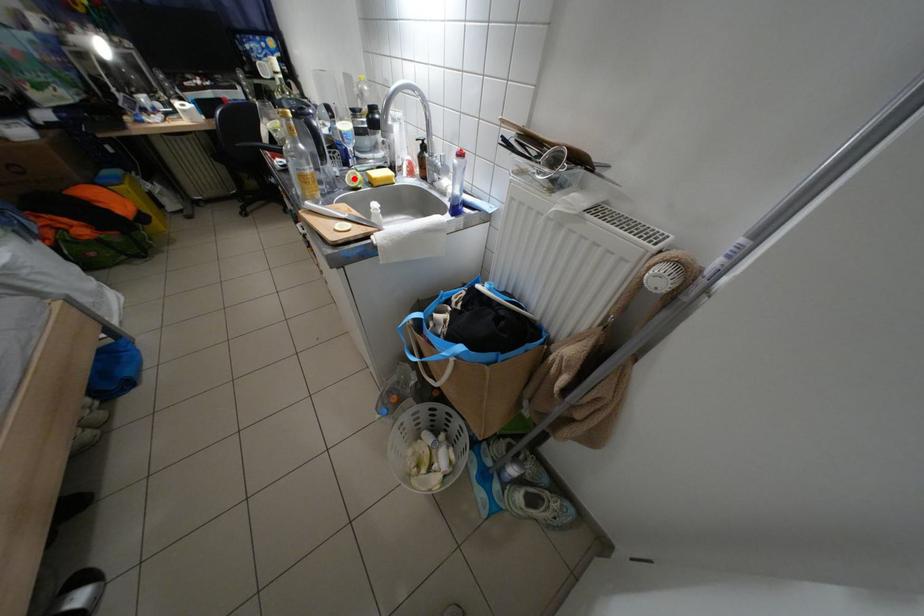
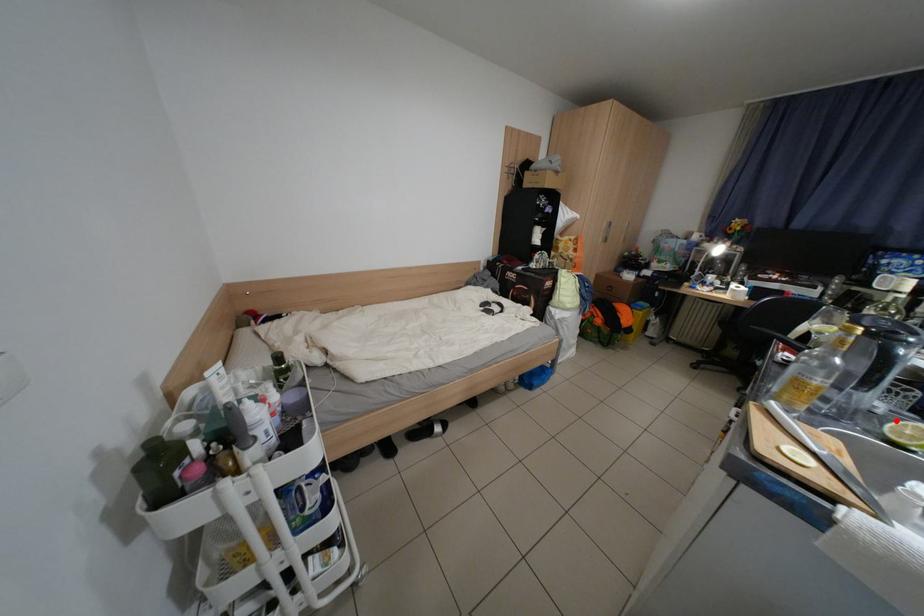
I am providing you with two images of the same scene from different viewpoints. A red point is marked on the first image and another point is marked on the second image. Is the marked point in image1 the same physical position as the marked point in image2?

Yes